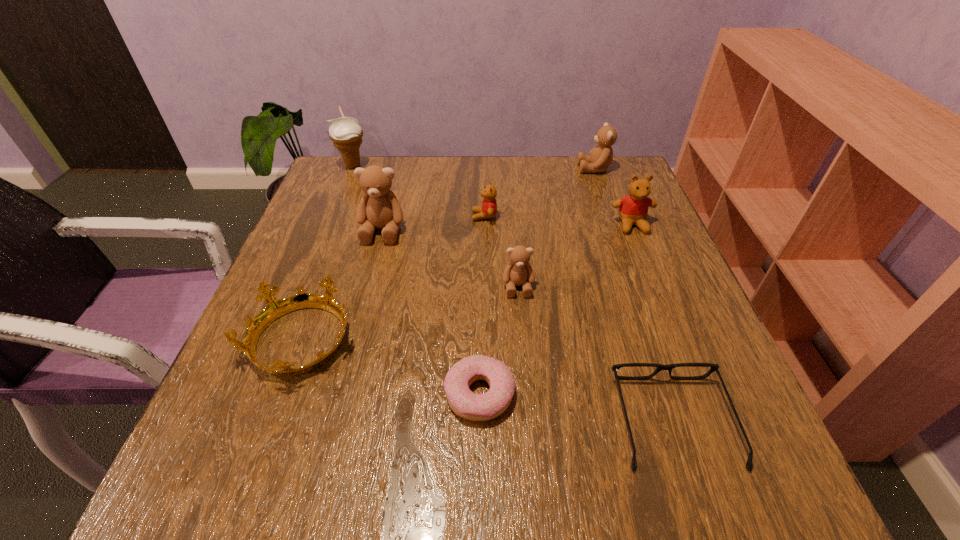
At what (x,y) coordinates should I click in order to perform the action: click on object at the near edge. Please return your answer as a coordinate pair (x, y). Image resolution: width=960 pixels, height=540 pixels. Looking at the image, I should click on (714, 367).

Identify the location of icecream that is positioned at the left edge. This screenshot has height=540, width=960. (346, 133).

Where is `teddy bear that is at the left edge`? Image resolution: width=960 pixels, height=540 pixels. teddy bear that is at the left edge is located at coordinates (379, 208).

Locate an element on the screen. crown that is at the left edge is located at coordinates (275, 308).

Find the location of `spectacles situated at the right edge`. spectacles situated at the right edge is located at coordinates (714, 367).

Find the location of a particular element. The height and width of the screenshot is (540, 960). object situated at the far left corner is located at coordinates (346, 133).

Identify the location of object situated at the far right corner. (600, 157).

Find the location of a particular element. The width and height of the screenshot is (960, 540). object located at the near right corner is located at coordinates (714, 367).

Where is `free location at the far edge`? This screenshot has height=540, width=960. free location at the far edge is located at coordinates (542, 158).

Locate an element on the screen. blank space at the near edge of the desktop is located at coordinates (355, 507).